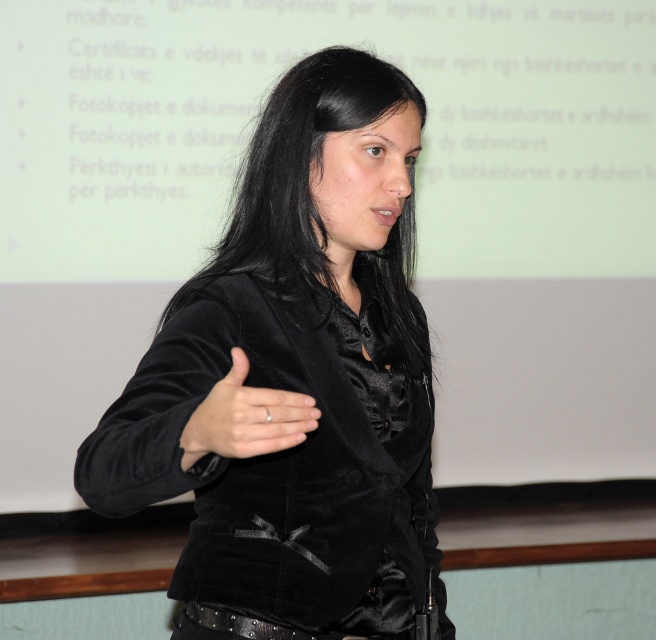
Between velvet black jacket at center and satin black hand at center, which one has more height?

velvet black jacket at center is taller.

Measure the distance between point (197, 323) and camera.

Point (197, 323) and camera are 4.71 feet apart from each other.

The image size is (656, 640). In order to click on velvet black jacket at center in this screenshot , I will do `click(295, 380)`.

You are a GUI agent. You are given a task and a screenshot of the screen. Output one action in this format:
    pyautogui.click(x=<x>, y=<y>)
    Task: Click on the velvet black jacket at center
    The width and height of the screenshot is (656, 640).
    Given the screenshot: What is the action you would take?
    pyautogui.click(x=295, y=380)

Is velvet black jacket at center thinner than black velvet hair at center?

No, velvet black jacket at center is not thinner than black velvet hair at center.

This screenshot has width=656, height=640. What are the coordinates of `velvet black jacket at center` in the screenshot? It's located at (295, 380).

Is point (401, 528) more distant than point (285, 140)?

No.

The width and height of the screenshot is (656, 640). In order to click on velvet black jacket at center in this screenshot , I will do `click(295, 380)`.

Is black velvet hair at center bigger than satin black hand at center?

Indeed, black velvet hair at center has a larger size compared to satin black hand at center.

From the picture: Does black velvet hair at center lie behind satin black hand at center?

Yes.

Which is behind, point (405, 266) or point (209, 433)?

The point (405, 266) is behind.

Where is `black velvet hair at center`? This screenshot has width=656, height=640. black velvet hair at center is located at coordinates (298, 173).